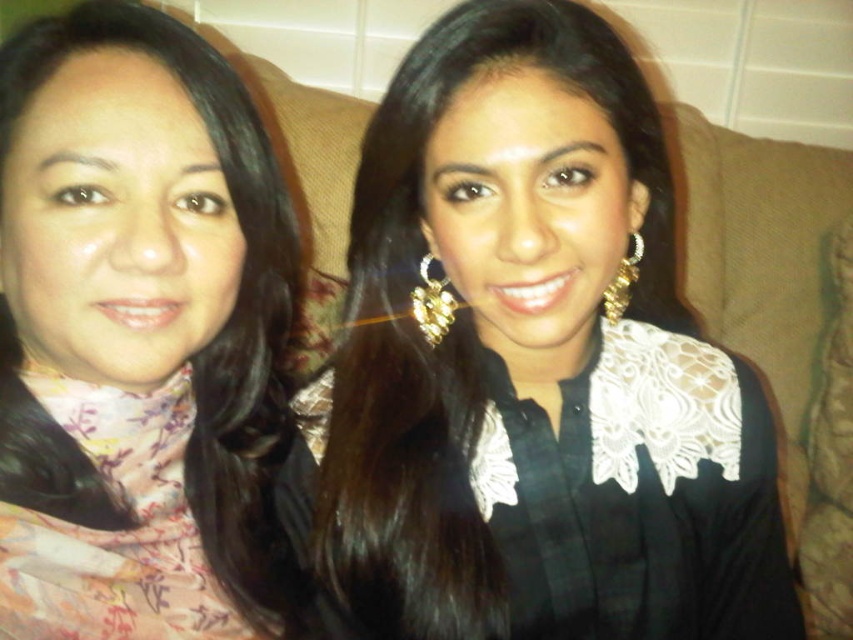
Question: Does black lace blouse at center appear under gold textured earring at upper right?

Choices:
 (A) yes
 (B) no

Answer: (A)

Question: Which object is the closest to the gold textured earring at upper right?

Choices:
 (A) matte floral scarf at left
 (B) black lace blouse at center

Answer: (B)

Question: Is matte floral scarf at left below gold textured earring at upper right?

Choices:
 (A) yes
 (B) no

Answer: (A)

Question: Is matte floral scarf at left positioned in front of gold textured earring at upper right?

Choices:
 (A) yes
 (B) no

Answer: (A)

Question: Which of the following is the closest to the observer?

Choices:
 (A) (456, 326)
 (B) (634, 252)

Answer: (A)

Question: Which of the following is the farthest from the observer?

Choices:
 (A) (13, 400)
 (B) (613, 323)

Answer: (B)